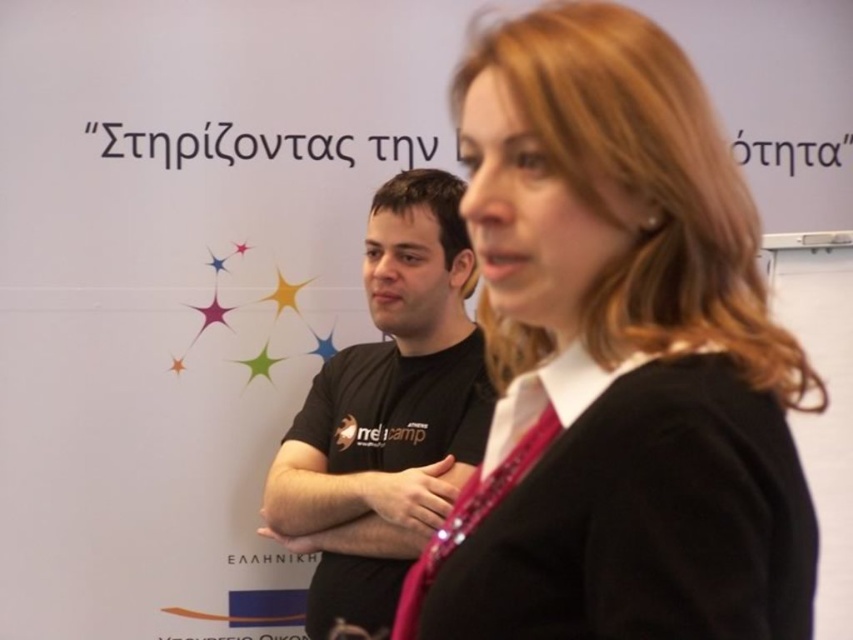
The height and width of the screenshot is (640, 853). I want to click on black matte jacket at center, so click(619, 358).

What do you see at coordinates (619, 358) in the screenshot? I see `black matte jacket at center` at bounding box center [619, 358].

Does point (697, 602) lie behind point (285, 474)?

No, it is not.

Image resolution: width=853 pixels, height=640 pixels. Find the location of `black matte jacket at center`. black matte jacket at center is located at coordinates (619, 358).